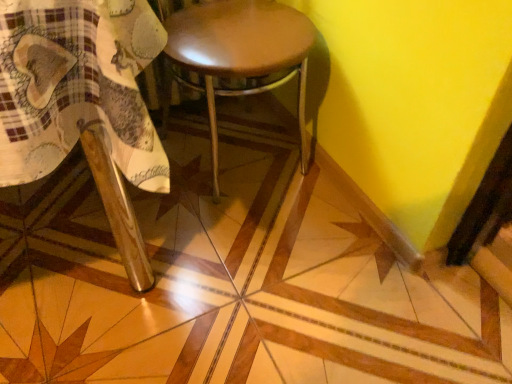
I want to click on vacant space that is in between wooden chair at lower left and shiny brown stool at center, so click(x=254, y=238).